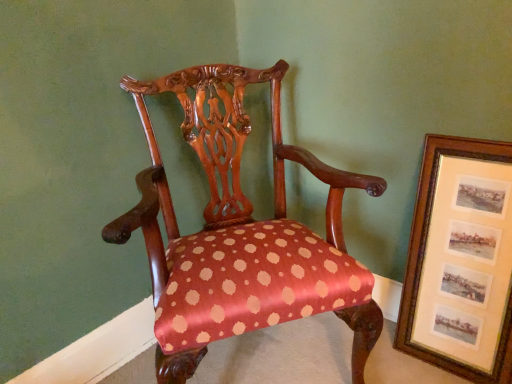
Question: Is the surface of polished wood chair at center in direct contact with wooden framed prints at right?

Choices:
 (A) no
 (B) yes

Answer: (A)

Question: Is polished wood chair at center to the left of wooden framed prints at right from the viewer's perspective?

Choices:
 (A) no
 (B) yes

Answer: (B)

Question: From a real-world perspective, is polished wood chair at center positioned over wooden framed prints at right based on gravity?

Choices:
 (A) no
 (B) yes

Answer: (B)

Question: Is wooden framed prints at right at the back of polished wood chair at center?

Choices:
 (A) no
 (B) yes

Answer: (A)

Question: Does polished wood chair at center have a lesser width compared to wooden framed prints at right?

Choices:
 (A) yes
 (B) no

Answer: (B)

Question: From the image's perspective, is polished wood chair at center located above wooden framed prints at right?

Choices:
 (A) no
 (B) yes

Answer: (B)

Question: From a real-world perspective, is wooden framed prints at right physically below polished wood chair at center?

Choices:
 (A) yes
 (B) no

Answer: (A)

Question: Is wooden framed prints at right wider than polished wood chair at center?

Choices:
 (A) no
 (B) yes

Answer: (A)

Question: Is wooden framed prints at right far away from polished wood chair at center?

Choices:
 (A) yes
 (B) no

Answer: (B)

Question: Is wooden framed prints at right bigger than polished wood chair at center?

Choices:
 (A) no
 (B) yes

Answer: (A)

Question: Considering the relative positions of wooden framed prints at right and polished wood chair at center in the image provided, is wooden framed prints at right to the left of polished wood chair at center from the viewer's perspective?

Choices:
 (A) yes
 (B) no

Answer: (B)

Question: Is wooden framed prints at right positioned in front of polished wood chair at center?

Choices:
 (A) no
 (B) yes

Answer: (A)

Question: Looking at their shapes, would you say polished wood chair at center is wider or thinner than wooden framed prints at right?

Choices:
 (A) thin
 (B) wide

Answer: (B)